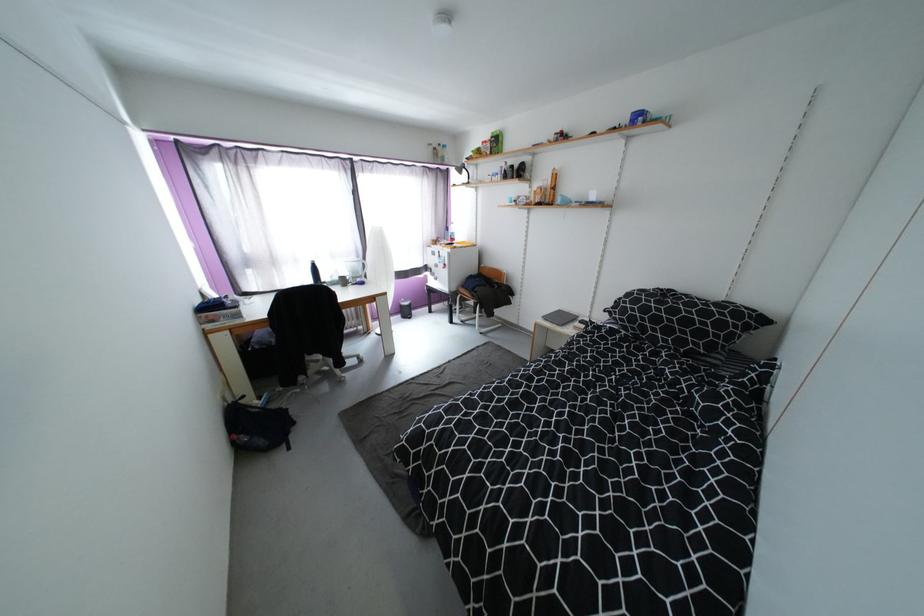
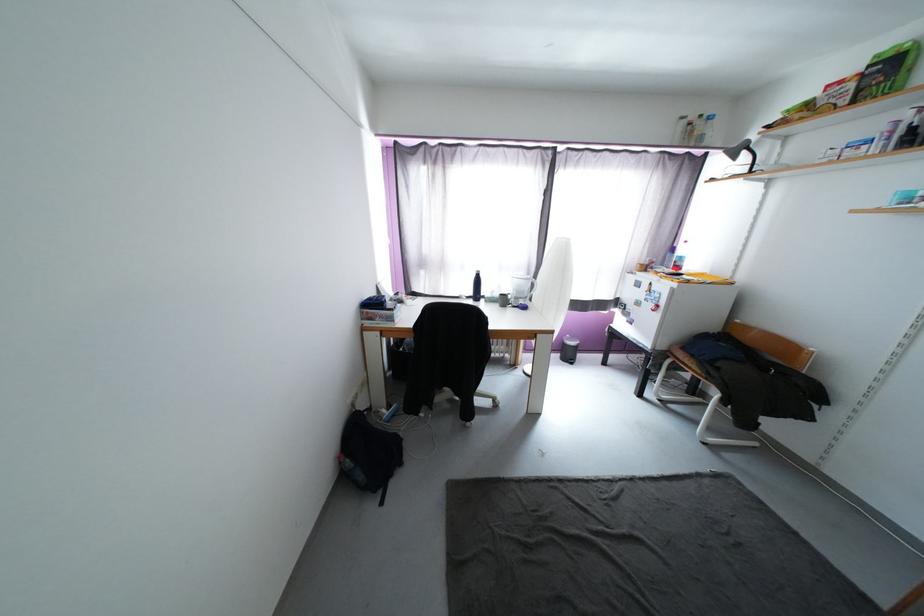
Question: The camera is either moving clockwise (left) or counter-clockwise (right) around the object. The first image is from the beginning of the video and the second image is from the end. Is the camera moving left or right when shooting the video?

Choices:
 (A) Left
 (B) Right

Answer: (B)